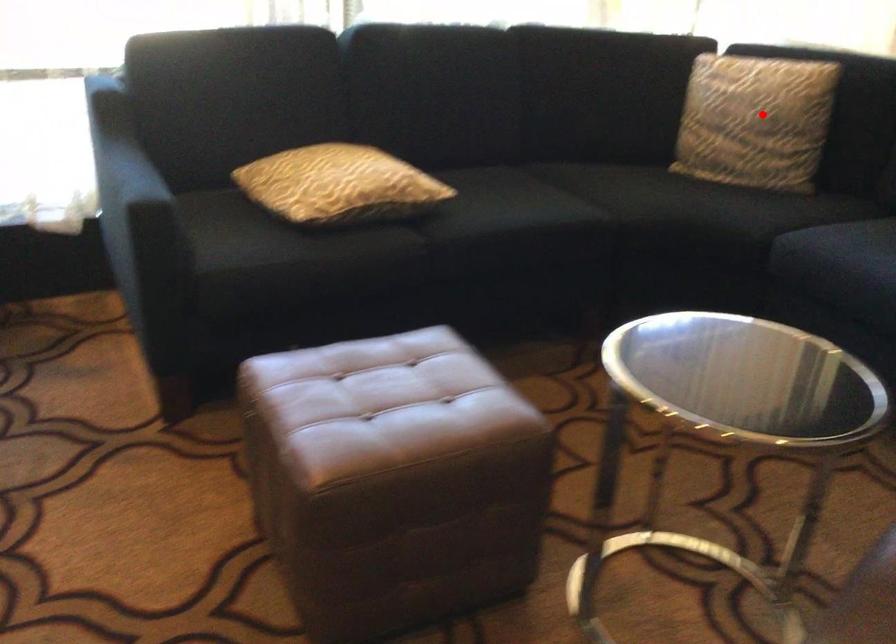
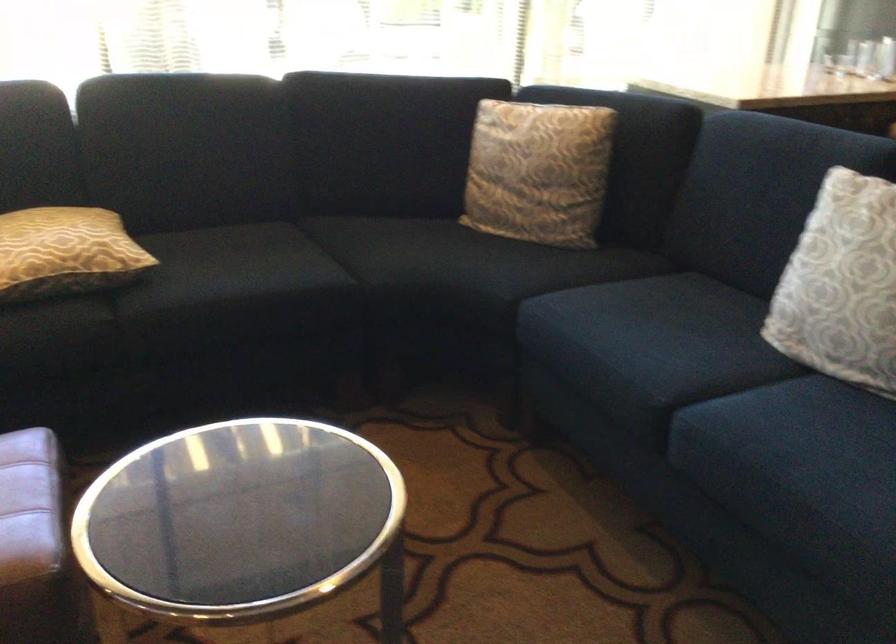
Where in the second image is the point corresponding to the highlighted location from the first image?

(538, 172)